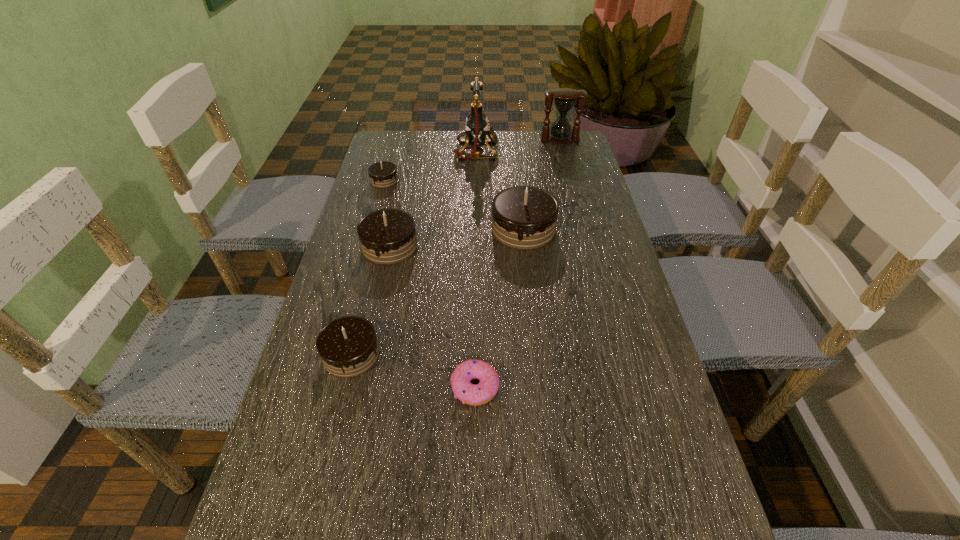
Identify which chocolate cake is the fourth nearest to the right red chocolate cake. Please provide its 2D coordinates. Your answer should be formatted as a tuple, i.e. [(x, y)], where the tuple contains the x and y coordinates of a point satisfying the conditions above.

[(523, 217)]

The width and height of the screenshot is (960, 540). What are the coordinates of `chocolate cake that is the fourth closest to the third shortest chocolate cake` in the screenshot? It's located at (309, 539).

Locate an element on the screen. This screenshot has height=540, width=960. the second closest chocolate chocolate cake to the third farthest object is located at coordinates (523, 217).

This screenshot has height=540, width=960. What are the coordinates of `chocolate chocolate cake that is the closest one to the third tallest chocolate cake` in the screenshot? It's located at (387, 236).

I want to click on free space that satisfies the following two spatial constraints: 1. on the front of the black telephone, featuring the rotary dial; 2. on the front side of the second biggest chocolate chocolate cake, so click(x=475, y=246).